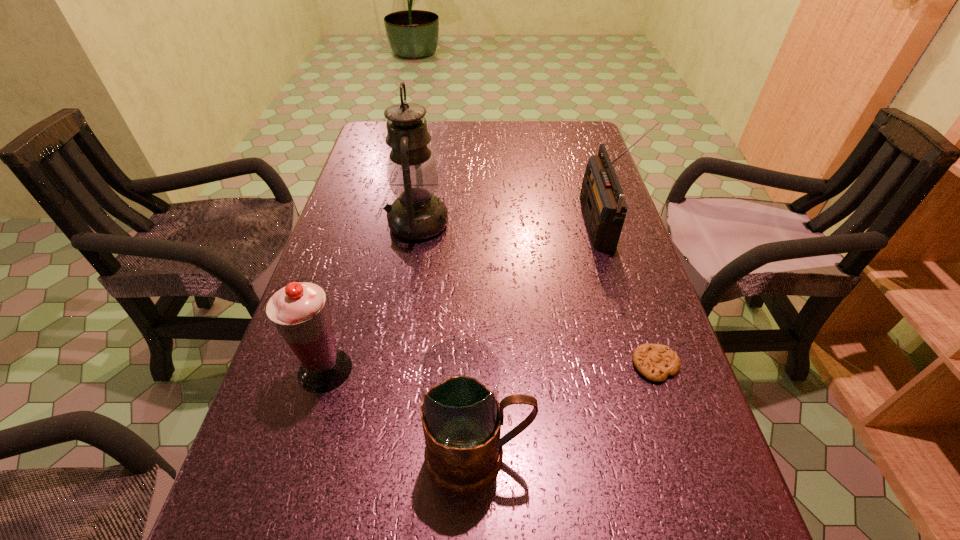
Where is `free space located 0.230m with the handle on the side of the nearest object`? This screenshot has width=960, height=540. free space located 0.230m with the handle on the side of the nearest object is located at coordinates (669, 454).

At what (x,y) coordinates should I click in order to perform the action: click on free space located 0.220m on the back of the cookie. Please return your answer as a coordinate pair (x, y). Image resolution: width=960 pixels, height=540 pixels. Looking at the image, I should click on (624, 270).

Image resolution: width=960 pixels, height=540 pixels. Identify the location of oil lamp situated at the left edge. (417, 214).

Image resolution: width=960 pixels, height=540 pixels. I want to click on smoothie that is at the left edge, so click(299, 311).

Locate an element on the screen. The height and width of the screenshot is (540, 960). radio receiver positioned at the right edge is located at coordinates (602, 198).

I want to click on cookie positioned at the right edge, so click(x=655, y=362).

The image size is (960, 540). What are the coordinates of `vacant space at the far edge of the desktop` in the screenshot? It's located at (429, 130).

In the image, there is a desktop. Where is `blank space at the left edge`? This screenshot has width=960, height=540. blank space at the left edge is located at coordinates 264,529.

Identify the location of vacant space at the right edge of the desktop. Image resolution: width=960 pixels, height=540 pixels. (660, 458).

Image resolution: width=960 pixels, height=540 pixels. Identify the location of free location at the far left corner. (385, 120).